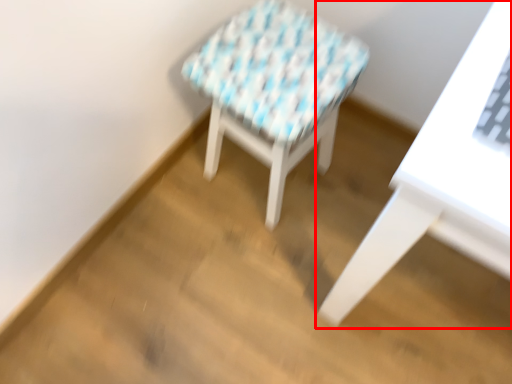
Question: From the image's perspective, where is table (annotated by the red box) located in relation to stool in the image?

Choices:
 (A) above
 (B) below

Answer: (B)